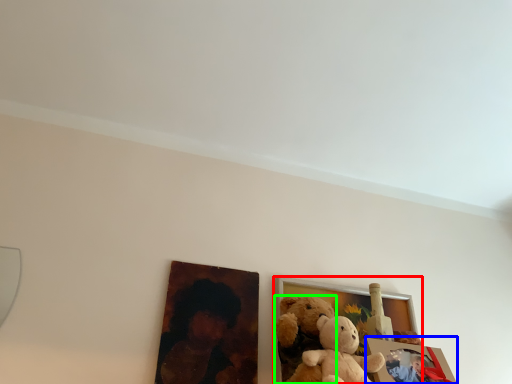
Question: Considering the real-world distances, which object is closest to picture frame (highlighted by a red box)? picture frame (highlighted by a blue box) or teddy bear (highlighted by a green box).

Choices:
 (A) picture frame
 (B) teddy bear

Answer: (B)